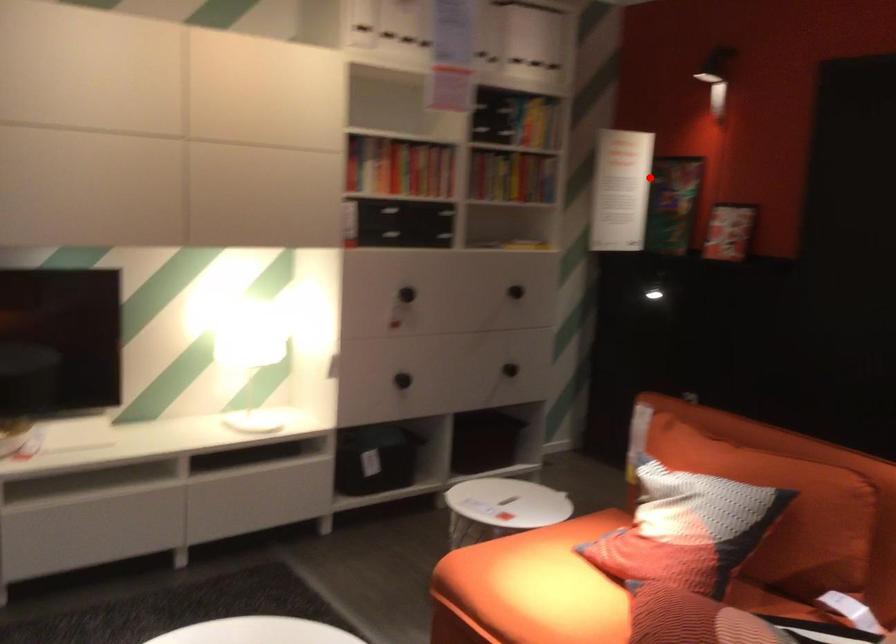
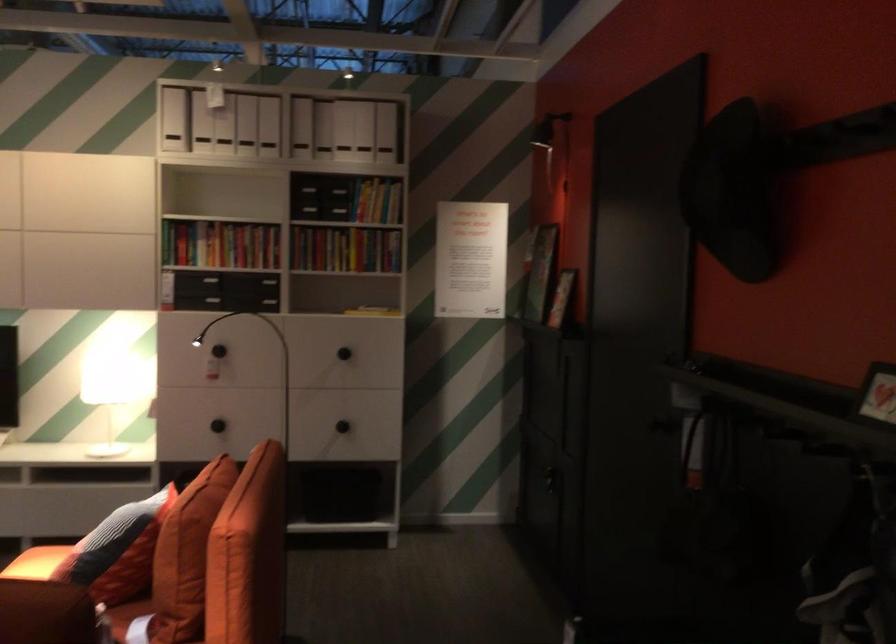
Locate, in the second image, the point that corresponds to the highlighted location in the first image.

(470, 259)